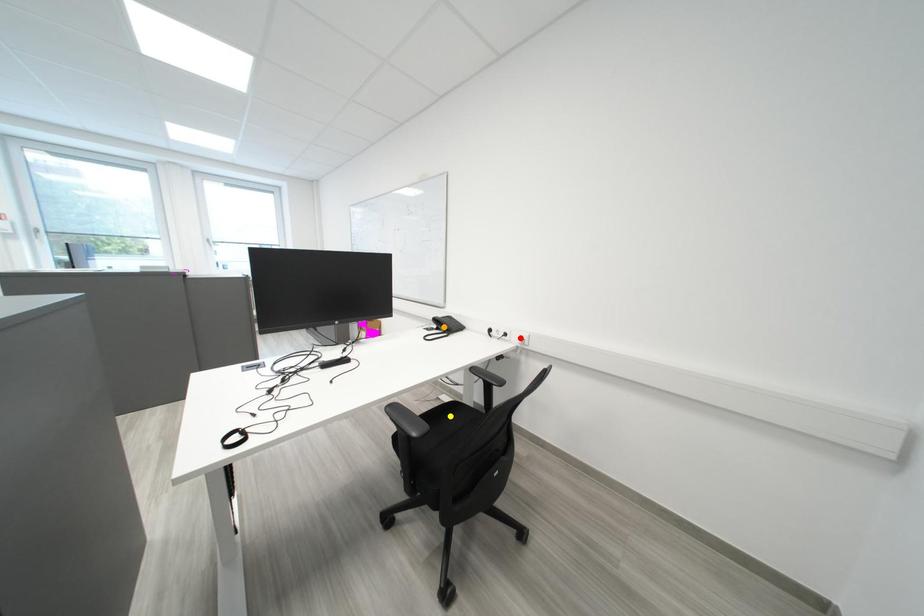
Looking at this image, order these from farthest to nearest:
yellow point
orange point
red point

1. yellow point
2. orange point
3. red point